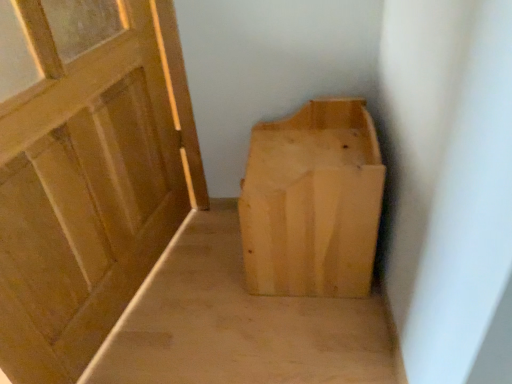
Question: Can you confirm if light wood/rough textured box at center is thinner than matte wood door at left?

Choices:
 (A) no
 (B) yes

Answer: (A)

Question: Does light wood/rough textured box at center have a lesser height compared to matte wood door at left?

Choices:
 (A) yes
 (B) no

Answer: (A)

Question: From the image's perspective, is light wood/rough textured box at center over matte wood door at left?

Choices:
 (A) yes
 (B) no

Answer: (B)

Question: From a real-world perspective, is light wood/rough textured box at center located beneath matte wood door at left?

Choices:
 (A) yes
 (B) no

Answer: (A)

Question: Is light wood/rough textured box at center aimed at matte wood door at left?

Choices:
 (A) yes
 (B) no

Answer: (A)

Question: Is light wood/rough textured box at center placed right next to matte wood door at left?

Choices:
 (A) no
 (B) yes

Answer: (A)

Question: Can you confirm if light wood bench at center is smaller than light wood/rough textured box at center?

Choices:
 (A) yes
 (B) no

Answer: (A)

Question: Considering the relative positions of light wood bench at center and light wood/rough textured box at center in the image provided, is light wood bench at center to the right of light wood/rough textured box at center from the viewer's perspective?

Choices:
 (A) no
 (B) yes

Answer: (A)

Question: Does light wood bench at center come in front of light wood/rough textured box at center?

Choices:
 (A) no
 (B) yes

Answer: (A)

Question: Is the surface of light wood bench at center in direct contact with light wood/rough textured box at center?

Choices:
 (A) no
 (B) yes

Answer: (A)

Question: Could you tell me if light wood bench at center is turned towards light wood/rough textured box at center?

Choices:
 (A) no
 (B) yes

Answer: (A)

Question: From the image's perspective, is light wood bench at center on light wood/rough textured box at center?

Choices:
 (A) yes
 (B) no

Answer: (B)

Question: Can you confirm if light wood/rough textured box at center is bigger than light wood bench at center?

Choices:
 (A) no
 (B) yes

Answer: (B)